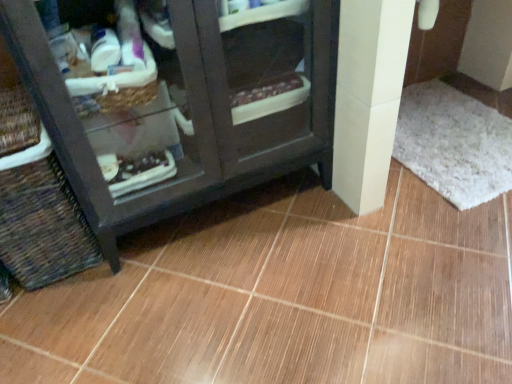
Locate an element on the screen. vacant area to the right of woven brown basket at lower left is located at coordinates (151, 257).